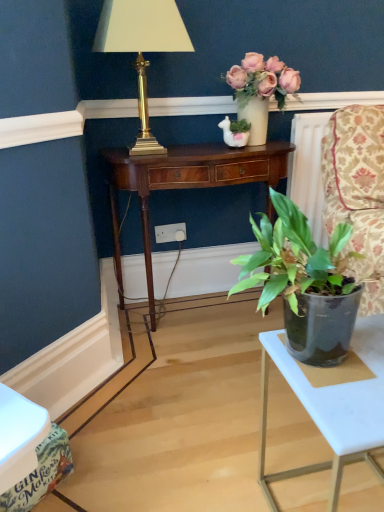
The height and width of the screenshot is (512, 384). I want to click on blank space situated above white plastic table at lower right (from a real-world perspective), so click(x=352, y=371).